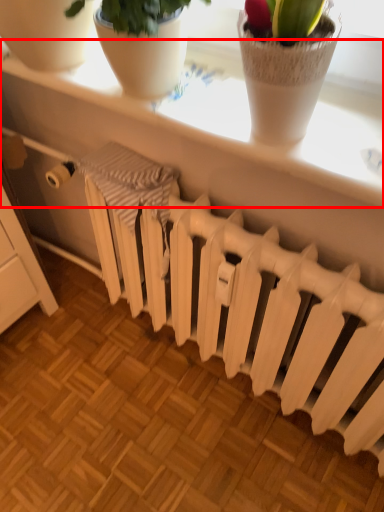
Question: In this image, where is window sill (annotated by the red box) located relative to radiator?

Choices:
 (A) left
 (B) right

Answer: (A)